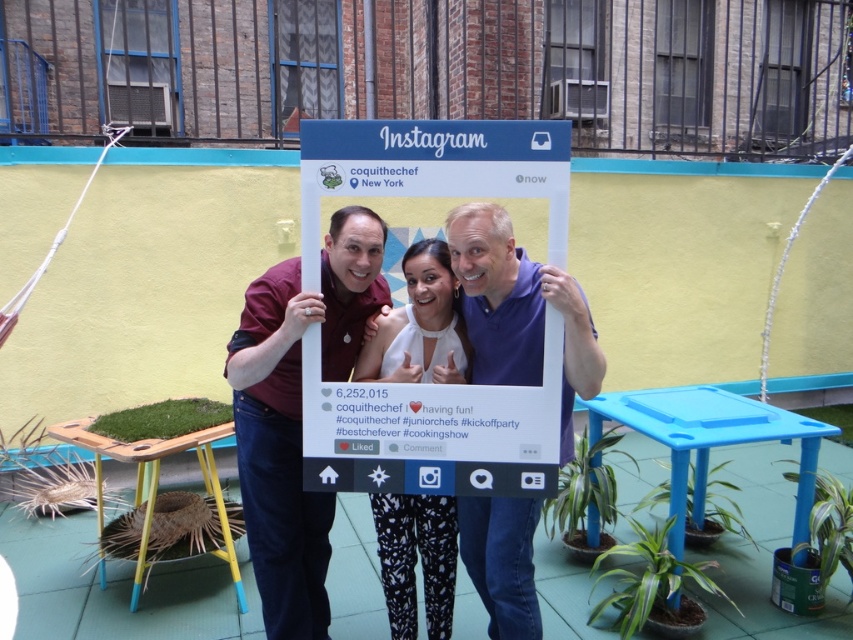
Question: Which of the following is the farthest from the observer?

Choices:
 (A) white printed pants at center
 (B) white cardboard frame at center
 (C) maroon fabric shirt at center

Answer: (A)

Question: Which of the following is the farthest from the observer?

Choices:
 (A) (379, 332)
 (B) (514, 339)
 (C) (433, 624)
 (D) (241, 420)

Answer: (C)

Question: Does purple matte shirt at center appear on the right side of white printed pants at center?

Choices:
 (A) yes
 (B) no

Answer: (A)

Question: Which point is closer to the camera?

Choices:
 (A) (575, 324)
 (B) (376, 516)

Answer: (A)

Question: From the image, what is the correct spatial relationship of maroon fabric shirt at center in relation to purple matte shirt at center?

Choices:
 (A) left
 (B) right

Answer: (A)

Question: Can you confirm if maroon fabric shirt at center is positioned above matte white frame at center?

Choices:
 (A) yes
 (B) no

Answer: (B)